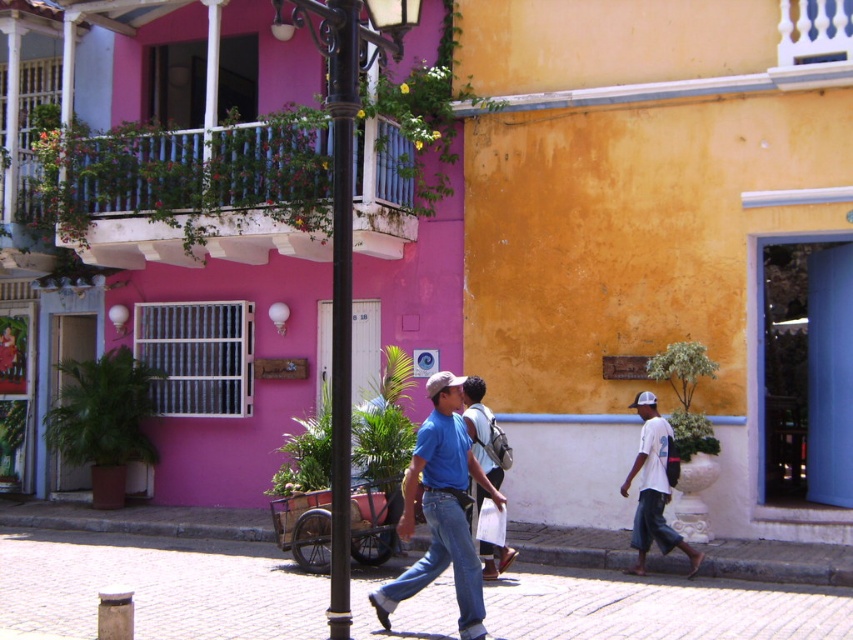
You are a photographer standing in the middle of the street. You see the blue denim jeans at center and the black metal pole at center. Which object is located to the right of the other?

The blue denim jeans at center is positioned on the right side of black metal pole at center.

You are a tourist standing in the middle of the street looking at the pink building with the white balcony. You notice a brick pavement at center and a matte blue shirt at center. Which object is closer to the ground?

The brick pavement at center is located below matte blue shirt at center, so it is closer to the ground.